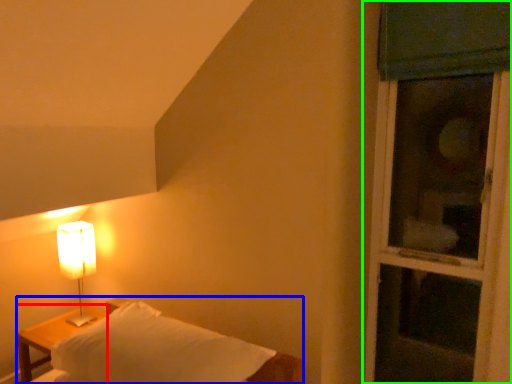
Question: Based on their relative distances, which object is farther from nightstand (highlighted by a red box)? Choose from furniture (highlighted by a blue box) and window (highlighted by a green box).

Choices:
 (A) furniture
 (B) window

Answer: (B)